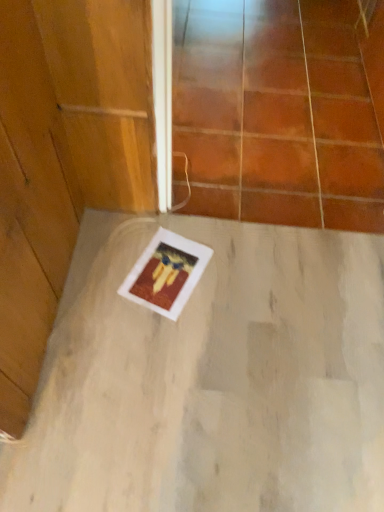
Find the location of a particular element. Image resolution: width=384 pixels, height=512 pixels. free spot above transparent glass door at upper center (from a real-world perspective) is located at coordinates (275, 86).